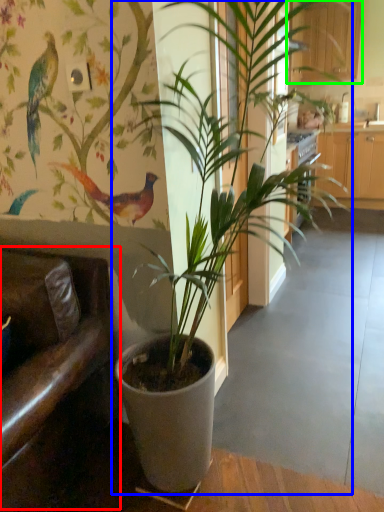
Question: Which object is the farthest from armchair (highlighted by a red box)? Choose among these: houseplant (highlighted by a blue box) or furniture (highlighted by a green box).

Choices:
 (A) houseplant
 (B) furniture

Answer: (B)